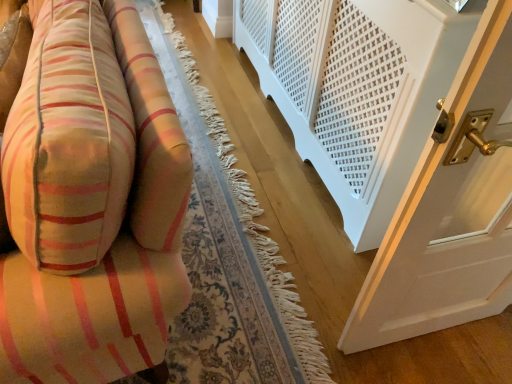
Question: From a real-world perspective, relative to white textured radiator at lower right, is soft cotton cushion at left vertically above or below?

Choices:
 (A) above
 (B) below

Answer: (A)

Question: In the image, is soft cotton cushion at left on the left side or the right side of white textured radiator at lower right?

Choices:
 (A) right
 (B) left

Answer: (B)

Question: From the image's perspective, is soft cotton cushion at left above or below white textured radiator at lower right?

Choices:
 (A) below
 (B) above

Answer: (A)

Question: In the image, is white textured radiator at lower right positioned in front of or behind soft cotton cushion at left?

Choices:
 (A) front
 (B) behind

Answer: (B)

Question: From the image's perspective, is white textured radiator at lower right above or below soft cotton cushion at left?

Choices:
 (A) above
 (B) below

Answer: (A)

Question: From their relative heights in the image, would you say white textured radiator at lower right is taller or shorter than soft cotton cushion at left?

Choices:
 (A) tall
 (B) short

Answer: (A)

Question: Visually, is white textured radiator at lower right positioned to the left or to the right of soft cotton cushion at left?

Choices:
 (A) right
 (B) left

Answer: (A)